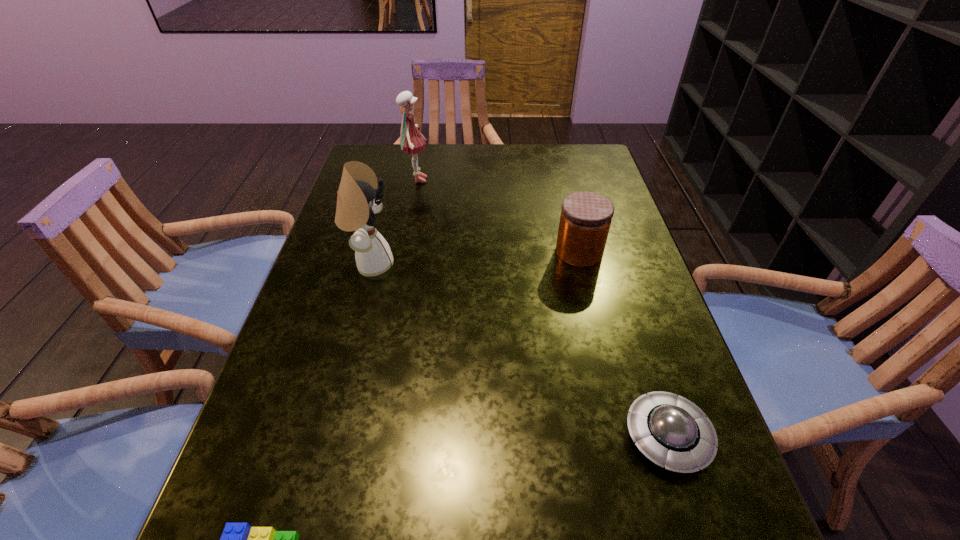
The width and height of the screenshot is (960, 540). In order to click on saucer located in the right edge section of the desktop in this screenshot , I will do `click(671, 431)`.

Locate an element on the screen. object present at the far left corner is located at coordinates (411, 141).

Locate an element on the screen. Image resolution: width=960 pixels, height=540 pixels. free point at the far edge is located at coordinates (525, 181).

The height and width of the screenshot is (540, 960). Find the location of `vacant area at the left edge of the desktop`. vacant area at the left edge of the desktop is located at coordinates (327, 278).

The height and width of the screenshot is (540, 960). Identify the location of blank space at the right edge. (671, 524).

I want to click on vacant space at the far right corner, so click(x=562, y=170).

The height and width of the screenshot is (540, 960). What are the coordinates of `free space between the nearer doll and the farther doll` in the screenshot? It's located at (394, 222).

This screenshot has height=540, width=960. Identify the location of free space between the farther doll and the saucer. (542, 308).

At what (x,y) coordinates should I click in order to perform the action: click on vacant area between the second nearest object and the nearer doll. Please return your answer as a coordinate pair (x, y). This screenshot has width=960, height=540. Looking at the image, I should click on (519, 350).

Locate an element on the screen. vacant area that lies between the saucer and the nearer doll is located at coordinates (519, 350).